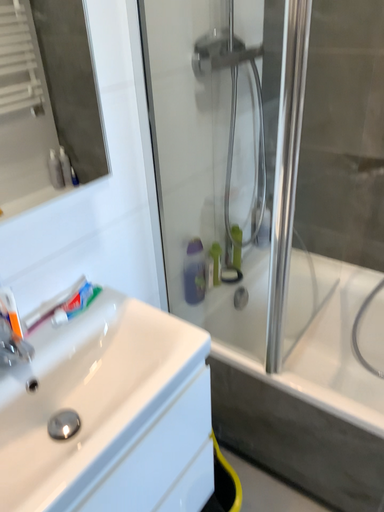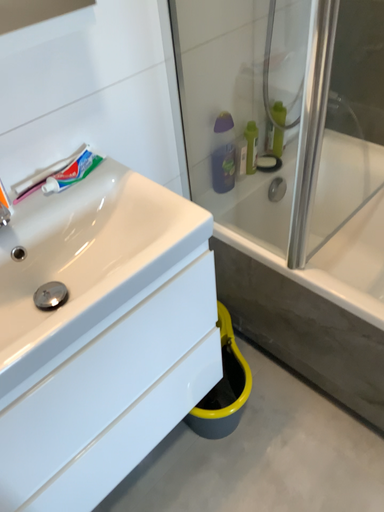
Question: How did the camera likely rotate when shooting the video?

Choices:
 (A) rotated upward
 (B) rotated downward

Answer: (B)